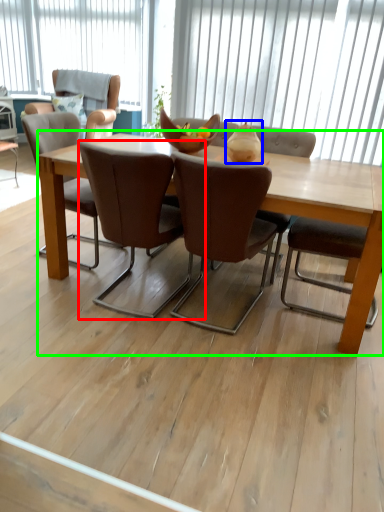
Question: Based on their relative distances, which object is farther from chair (highlighted by a red box)? Choose from vase (highlighted by a blue box) and coffee table (highlighted by a green box).

Choices:
 (A) vase
 (B) coffee table

Answer: (B)